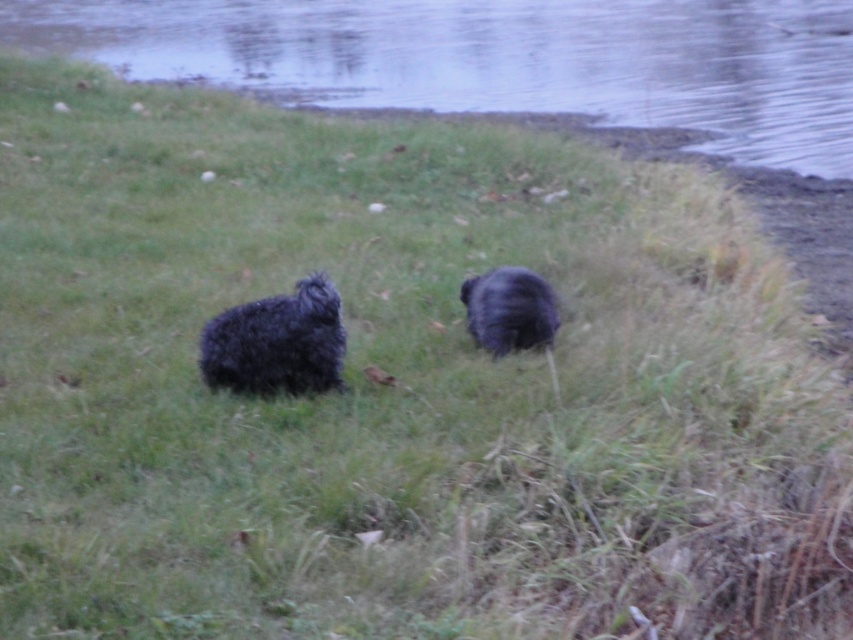
Does fuzzy black dog at left have a larger size compared to black fluffy dog at center?

Yes.

Find the location of a particular element. fuzzy black dog at left is located at coordinates (277, 342).

Locate an element on the screen. fuzzy black dog at left is located at coordinates (277, 342).

Where is `smooth water at center`? smooth water at center is located at coordinates (503, 60).

Is smooth water at center above black fluffy dog at center?

Yes, smooth water at center is above black fluffy dog at center.

The image size is (853, 640). I want to click on smooth water at center, so click(503, 60).

Is point (802, 36) positioned in front of point (233, 369)?

No, (802, 36) is behind (233, 369).

Is point (202, 1) farther from viewer compared to point (340, 349)?

Yes, it is behind point (340, 349).

Find the location of `smooth water at center`. smooth water at center is located at coordinates (503, 60).